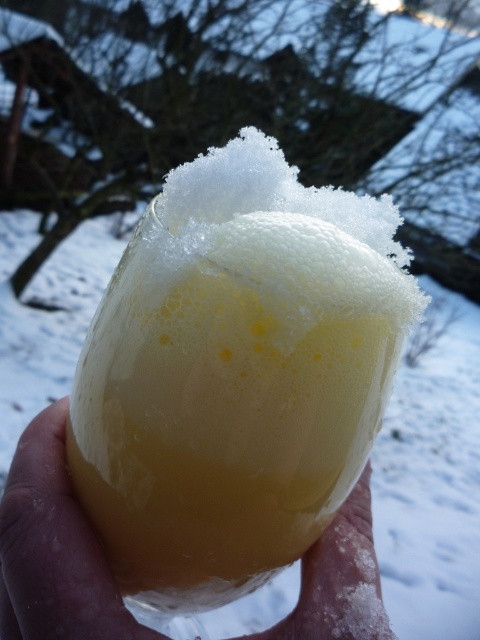
Is translucent glass at center bigger than translucent plastic cup at center?

Yes, translucent glass at center is bigger than translucent plastic cup at center.

Can you confirm if translucent glass at center is positioned to the left of translucent plastic cup at center?

In fact, translucent glass at center is to the right of translucent plastic cup at center.

Where is `translucent glass at center`? The width and height of the screenshot is (480, 640). translucent glass at center is located at coordinates (229, 401).